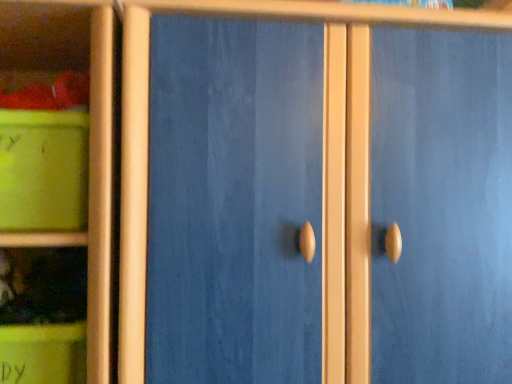
Question: Considering the positions of matte green plastic container at left and green matte container at lower left in the image, is matte green plastic container at left wider or thinner than green matte container at lower left?

Choices:
 (A) wide
 (B) thin

Answer: (A)

Question: From their relative heights in the image, would you say matte green plastic container at left is taller or shorter than green matte container at lower left?

Choices:
 (A) short
 (B) tall

Answer: (B)

Question: Is matte green plastic container at left spatially inside green matte container at lower left, or outside of it?

Choices:
 (A) inside
 (B) outside

Answer: (B)

Question: Is green matte container at lower left wider or thinner than matte green plastic container at left?

Choices:
 (A) thin
 (B) wide

Answer: (A)

Question: From a real-world perspective, is green matte container at lower left above or below matte green plastic container at left?

Choices:
 (A) above
 (B) below

Answer: (B)

Question: From the image's perspective, relative to matte green plastic container at left, is green matte container at lower left above or below?

Choices:
 (A) above
 (B) below

Answer: (B)

Question: Which is correct: green matte container at lower left is inside matte green plastic container at left, or outside of it?

Choices:
 (A) outside
 (B) inside

Answer: (A)